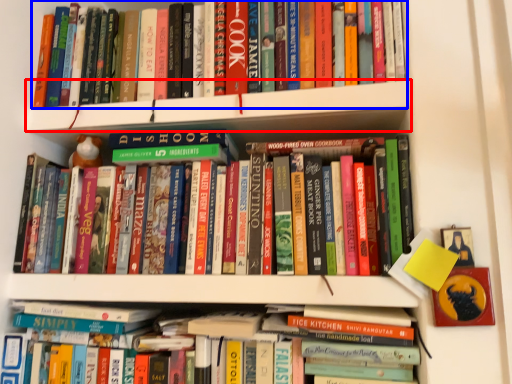
Question: Which point is closer to the camera, shelf (highlighted by a red box) or book (highlighted by a blue box)?

Choices:
 (A) shelf
 (B) book

Answer: (A)